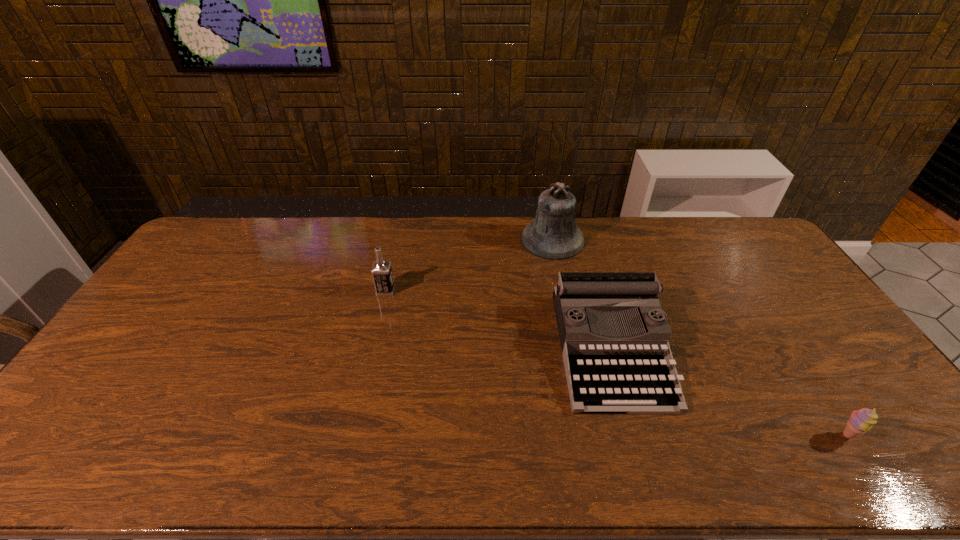
Image resolution: width=960 pixels, height=540 pixels. What are the coordinates of `free space that satisfies the following two spatial constraints: 1. on the front label of the rightmost object; 2. on the left side of the second farthest object` in the screenshot? It's located at (352, 435).